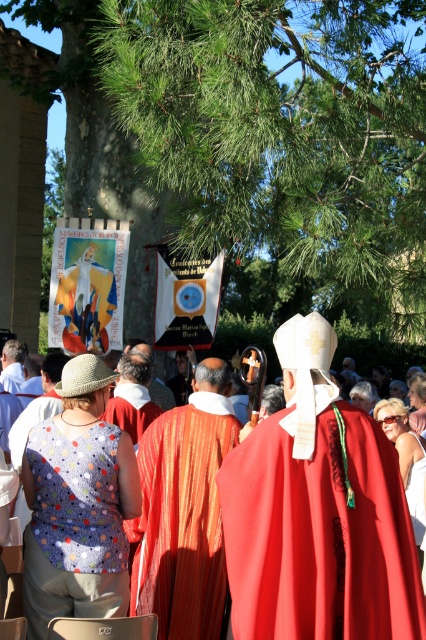
You are a photographer standing 2 meters away from the matte red cape at center and orange silk robe at center. You want to capture both objects in a single frame without moving your camera. Is it possible to include both in your shot if your camera has a 1.5 meter field of view?

The matte red cape at center and orange silk robe at center are 1.41 meters apart. Since your camera has a 1.5 meter field of view and you are 2 meters away, the distance between them is within the camera field of view. Therefore, both objects can be captured in a single frame without moving the camera.

You are a photographer trying to capture a clear shot of both the red velvet cape at center and the orange silk robe at center. Since you can only focus on one object at a time, which one should you focus on to ensure the other remains in the background?

You should focus on the red velvet cape at center because it is in front of the orange silk robe at center, so if you focus on the front object, the one behind will naturally be in the background.

You are an observer at the religious procession. You notice two capes worn by the clergy members. Which of the two capes, the red velvet cape at center or the matte red cape at center, is narrower in width?

The red velvet cape at center is thinner than the matte red cape at center, so the red velvet cape at center is narrower in width.